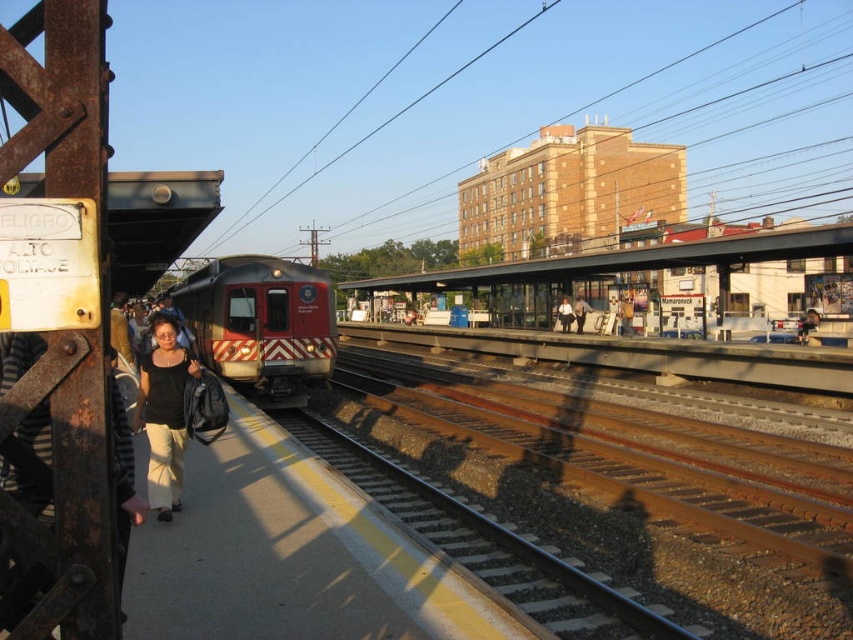
You are a fashion designer analyzing clothing proportions. You observe a person wearing a black cotton shirt at center and dark blue jeans at center in the scene. Which piece of clothing has a narrower width?

The black cotton shirt at center has a lesser width compared to the dark blue jeans at center, so the black cotton shirt at center is narrower.